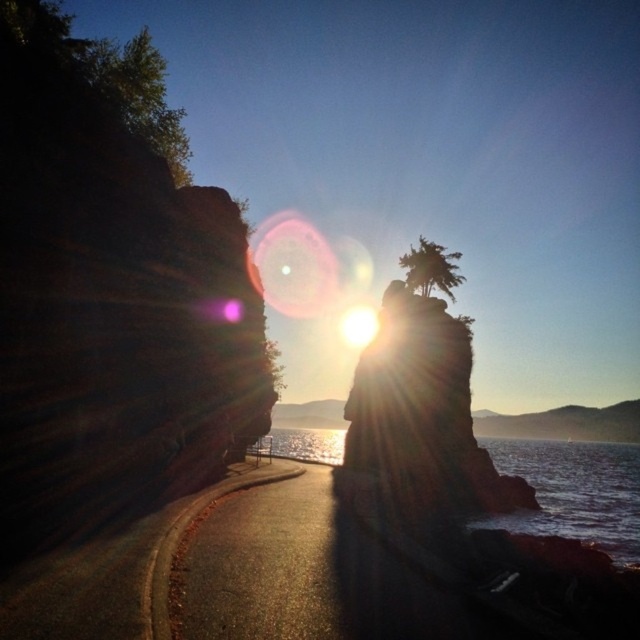
In order to click on rustic stone rock formation at center in this screenshot , I will do `click(422, 413)`.

Is point (369, 451) positioned behind point (365, 339)?

No, it is not.

What are the coordinates of `rustic stone rock formation at center` in the screenshot? It's located at (422, 413).

Who is lower down, translucent glass water at center or bright white light at center?

Positioned lower is translucent glass water at center.

Based on the photo, can you confirm if translucent glass water at center is positioned to the left of bright white light at center?

Incorrect, translucent glass water at center is not on the left side of bright white light at center.

Is point (548, 444) farther from viewer compared to point (356, 346)?

No, it is in front of (356, 346).

Where is `translucent glass water at center`? The height and width of the screenshot is (640, 640). translucent glass water at center is located at coordinates (573, 492).

Does point (408, 340) come closer to viewer compared to point (624, 500)?

Yes, point (408, 340) is closer to viewer.

The height and width of the screenshot is (640, 640). I want to click on rustic stone rock formation at center, so click(x=422, y=413).

Locate an element on the screen. The width and height of the screenshot is (640, 640). rustic stone rock formation at center is located at coordinates click(x=422, y=413).

Where is `rustic stone rock formation at center`? The height and width of the screenshot is (640, 640). rustic stone rock formation at center is located at coordinates (422, 413).